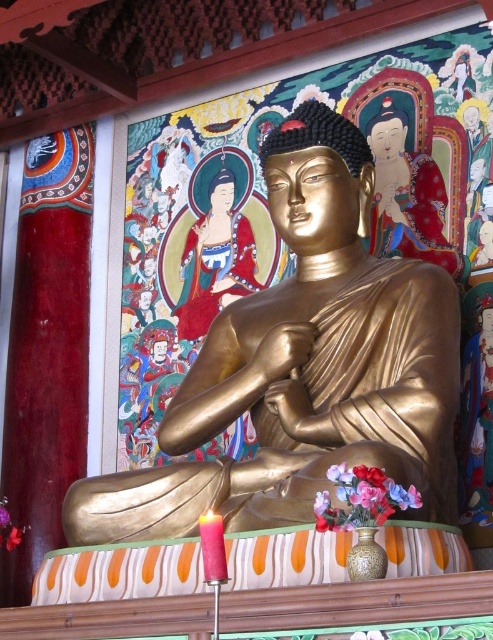
Does gold polished statue at center appear under smooth gold statue at center?

Yes.

In the scene shown: Is gold polished statue at center taller than smooth gold statue at center?

Yes.

This screenshot has height=640, width=493. Identify the location of gold polished statue at center. (304, 365).

Find the location of a particular element. gold polished statue at center is located at coordinates (304, 365).